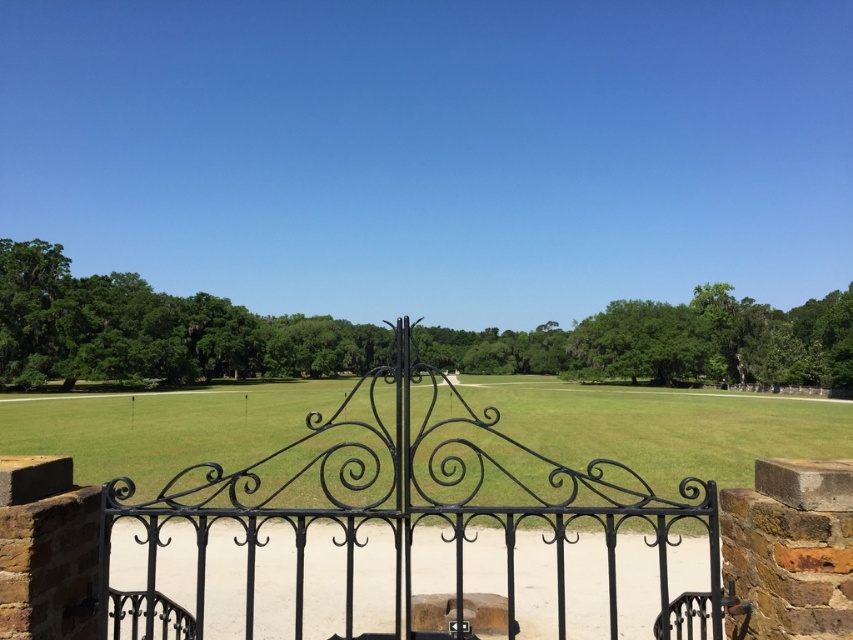
Question: Does black wrought iron gate at center lie in front of green grass at center?

Choices:
 (A) no
 (B) yes

Answer: (B)

Question: In this image, where is black wrought iron gate at center located relative to green grass at center?

Choices:
 (A) below
 (B) above

Answer: (B)

Question: Which point is closer to the camera taking this photo?

Choices:
 (A) (650, 477)
 (B) (461, 616)

Answer: (B)

Question: Can you confirm if black wrought iron gate at center is positioned above green grass at center?

Choices:
 (A) no
 (B) yes

Answer: (B)